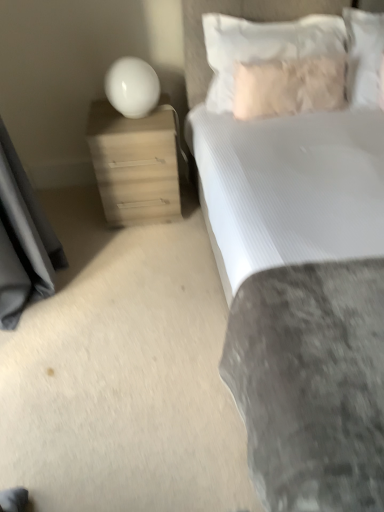
Question: Is white soft pillow at upper right, the 1th pillow in the right-to-left sequence, taller or shorter than fuzzy beige pillow at upper right, which ranks as the 2th pillow in left-to-right order?

Choices:
 (A) short
 (B) tall

Answer: (B)

Question: Is white soft pillow at upper right, the 3th pillow positioned from the left, bigger or smaller than fuzzy beige pillow at upper right, which ranks as the 2th pillow in left-to-right order?

Choices:
 (A) big
 (B) small

Answer: (A)

Question: Estimate the real-world distances between objects in this image. Which object is closer to the white soft pillow at upper right, the 1th pillow positioned from the left?

Choices:
 (A) white soft pillow at upper right, the 1th pillow in the right-to-left sequence
 (B) white glossy sphere at upper left
 (C) white textured bed at upper right
 (D) matte wood nightstand at left
 (E) fuzzy beige pillow at upper right, which ranks as the 2th pillow in left-to-right order

Answer: (E)

Question: Considering the real-world distances, which object is closest to the white textured bed at upper right?

Choices:
 (A) white soft pillow at upper right, the 1th pillow positioned from the left
 (B) matte wood nightstand at left
 (C) fuzzy beige pillow at upper right, which ranks as the 2th pillow in left-to-right order
 (D) white glossy sphere at upper left
 (E) white soft pillow at upper right, the 3th pillow positioned from the left

Answer: (C)